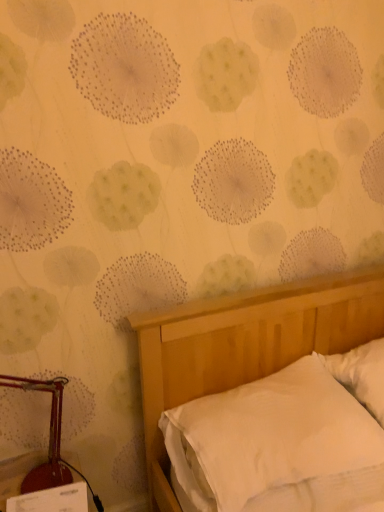
You are a GUI agent. You are given a task and a screenshot of the screen. Output one action in this format:
    pyautogui.click(x=<x>, y=<y>)
    Task: Click on the white smooth bed at lower right
    The height and width of the screenshot is (512, 384).
    Given the screenshot: What is the action you would take?
    pyautogui.click(x=245, y=345)

Identify the location of white smooth bed at lower right. (245, 345).

Find the location of a particular element. The image size is (384, 512). pillow located above the white smooth bed at lower right (from the image's perspective) is located at coordinates (361, 375).

In the scene shown: Does white smooth bed at lower right turn towards white soft pillow at right?

No, white smooth bed at lower right is not aimed at white soft pillow at right.

From a real-world perspective, is white smooth bed at lower right located higher than white soft pillow at right?

Incorrect, from a real-world perspective, white smooth bed at lower right is lower than white soft pillow at right.

Considering the relative sizes of metallic red lamp at left and white smooth bed at lower right in the image provided, is metallic red lamp at left smaller than white smooth bed at lower right?

Yes, metallic red lamp at left is smaller than white smooth bed at lower right.

At what (x,y) coordinates should I click in order to perform the action: click on bedside lamp above the white smooth bed at lower right (from the image's perspective). Please return your answer as a coordinate pair (x, y). This screenshot has height=512, width=384. Looking at the image, I should click on (49, 439).

Is metallic red lamp at left wider or thinner than white smooth bed at lower right?

In the image, metallic red lamp at left appears to be more narrow than white smooth bed at lower right.

From the picture: Would you say metallic red lamp at left is a long distance from white soft pillow at right?

Absolutely, metallic red lamp at left is distant from white soft pillow at right.

From the image's perspective, is metallic red lamp at left located beneath white soft pillow at right?

Indeed, from the image's perspective, metallic red lamp at left is shown beneath white soft pillow at right.

Is metallic red lamp at left facing towards white soft pillow at right?

No, metallic red lamp at left is not facing towards white soft pillow at right.

Is metallic red lamp at left further to camera compared to white soft pillow at right?

No, metallic red lamp at left is in front of white soft pillow at right.

Is white soft pillow at right further to camera compared to metallic red lamp at left?

Yes.

From the image's perspective, is white soft pillow at right located above metallic red lamp at left?

Yes, from the image's perspective, white soft pillow at right is above metallic red lamp at left.

Is white soft pillow at right taller or shorter than metallic red lamp at left?

Considering their sizes, white soft pillow at right has less height than metallic red lamp at left.

From the image's perspective, which one is positioned lower, white smooth bed at lower right or metallic red lamp at left?

white smooth bed at lower right, from the image's perspective.

Looking at this image, considering the relative positions of white smooth bed at lower right and metallic red lamp at left in the image provided, is white smooth bed at lower right behind metallic red lamp at left?

No.

Locate an element on the screen. The image size is (384, 512). bedside lamp that is behind the white smooth bed at lower right is located at coordinates (49, 439).

Is the surface of white smooth bed at lower right in direct contact with metallic red lamp at left?

No, white smooth bed at lower right is not in contact with metallic red lamp at left.

Which object is thinner, white soft pillow at right or white smooth bed at lower right?

With smaller width is white soft pillow at right.

Which is behind, white soft pillow at right or white smooth bed at lower right?

Positioned behind is white soft pillow at right.

Is white soft pillow at right taller than white smooth bed at lower right?

Yes, white soft pillow at right is taller than white smooth bed at lower right.

Where is `pillow positioned vertically above the white smooth bed at lower right (from a real-world perspective)`? This screenshot has width=384, height=512. pillow positioned vertically above the white smooth bed at lower right (from a real-world perspective) is located at coordinates (361, 375).

Identify the location of bed below the metallic red lamp at left (from the image's perspective). The width and height of the screenshot is (384, 512). (245, 345).

When comparing their distances from metallic red lamp at left, does white soft pillow at right or white smooth bed at lower right seem further?

Among the two, white soft pillow at right is located further to metallic red lamp at left.

From the image, which object appears to be farther from white smooth bed at lower right, white soft pillow at right or metallic red lamp at left?

metallic red lamp at left lies further to white smooth bed at lower right than the other object.

From the image, which object appears to be farther from metallic red lamp at left, white smooth bed at lower right or white soft pillow at right?

The object further to metallic red lamp at left is white soft pillow at right.

When comparing their distances from white soft pillow at right, does metallic red lamp at left or white smooth bed at lower right seem closer?

white smooth bed at lower right lies closer to white soft pillow at right than the other object.

Considering their positions, is metallic red lamp at left positioned closer to white smooth bed at lower right than white soft pillow at right?

white soft pillow at right is closer to white smooth bed at lower right.

Estimate the real-world distances between objects in this image. Which object is further from white soft pillow at right, white smooth bed at lower right or metallic red lamp at left?

metallic red lamp at left is further to white soft pillow at right.

Image resolution: width=384 pixels, height=512 pixels. Identify the location of bed between metallic red lamp at left and white soft pillow at right from left to right. (245, 345).